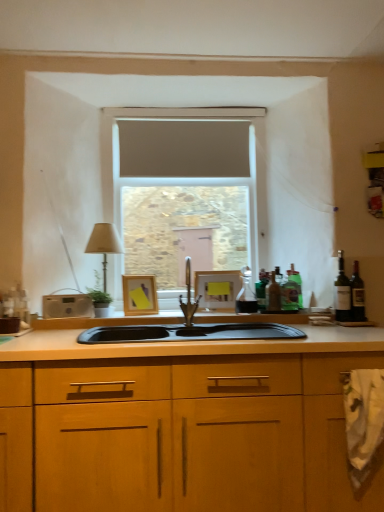
Question: Is beige fabric lampshade at left bigger than green glass bottle at right, the 1th bottle when ordered from right to left?

Choices:
 (A) no
 (B) yes

Answer: (B)

Question: Is green glass bottle at right, which ranks as the fourth bottle in left-to-right order, surrounded by beige fabric lampshade at left?

Choices:
 (A) no
 (B) yes

Answer: (A)

Question: From a real-world perspective, is beige fabric lampshade at left on green glass bottle at right, which ranks as the fourth bottle in left-to-right order?

Choices:
 (A) no
 (B) yes

Answer: (B)

Question: Considering the relative sizes of beige fabric lampshade at left and green glass bottle at right, the 1th bottle when ordered from right to left, in the image provided, is beige fabric lampshade at left thinner than green glass bottle at right, the 1th bottle when ordered from right to left,?

Choices:
 (A) yes
 (B) no

Answer: (B)

Question: Is green glass bottle at right, which ranks as the fourth bottle in left-to-right order, at the back of beige fabric lampshade at left?

Choices:
 (A) no
 (B) yes

Answer: (A)

Question: In the image, is wooden picture frame at center, which ranks as the second picture frame in right-to-left order, positioned in front of or behind beige fabric lampshade at left?

Choices:
 (A) front
 (B) behind

Answer: (A)

Question: Is wooden picture frame at center, which ranks as the second picture frame in right-to-left order, bigger or smaller than beige fabric lampshade at left?

Choices:
 (A) small
 (B) big

Answer: (A)

Question: Is wooden picture frame at center, which ranks as the second picture frame in right-to-left order, spatially inside beige fabric lampshade at left, or outside of it?

Choices:
 (A) outside
 (B) inside

Answer: (A)

Question: Considering the positions of point (137, 309) and point (107, 234), is point (137, 309) closer or farther from the camera than point (107, 234)?

Choices:
 (A) closer
 (B) farther

Answer: (A)

Question: From the image's perspective, is translucent glass bottle at right, placed as the second bottle when sorted from left to right, above or below matte gray screen at center?

Choices:
 (A) below
 (B) above

Answer: (A)

Question: Would you say translucent glass bottle at right, placed as the second bottle when sorted from left to right, is to the left or to the right of matte gray screen at center in the picture?

Choices:
 (A) left
 (B) right

Answer: (B)

Question: Considering the positions of translucent glass bottle at right, which is the third bottle from right to left, and matte gray screen at center in the image, is translucent glass bottle at right, which is the third bottle from right to left, wider or thinner than matte gray screen at center?

Choices:
 (A) thin
 (B) wide

Answer: (A)

Question: From a real-world perspective, is translucent glass bottle at right, placed as the second bottle when sorted from left to right, above or below matte gray screen at center?

Choices:
 (A) above
 (B) below

Answer: (B)

Question: Is green glass bottle at right, acting as the third bottle starting from the left, inside the boundaries of polished stainless steel faucet at center, or outside?

Choices:
 (A) outside
 (B) inside

Answer: (A)

Question: From a real-world perspective, is green glass bottle at right, acting as the third bottle starting from the left, above or below polished stainless steel faucet at center?

Choices:
 (A) below
 (B) above

Answer: (A)